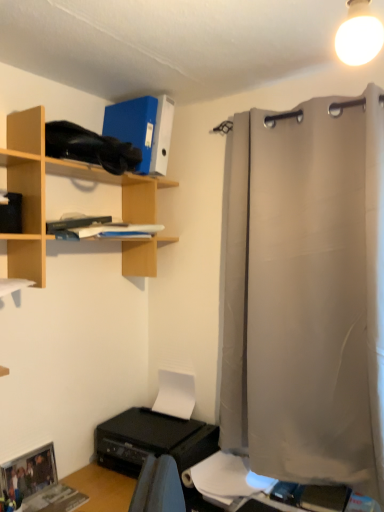
Question: Is point (374, 256) closer or farther from the camera than point (216, 470)?

Choices:
 (A) farther
 (B) closer

Answer: (B)

Question: Considering the positions of light gray fabric curtain at right and white paper at lower center in the image, is light gray fabric curtain at right bigger or smaller than white paper at lower center?

Choices:
 (A) big
 (B) small

Answer: (A)

Question: Estimate the real-world distances between objects in this image. Which object is closer to the wooden shelf at upper left?

Choices:
 (A) black plastic printer at lower left
 (B) white paper at lower center
 (C) light gray fabric curtain at right
 (D) white matte book at upper center
 (E) white matte paper at lower center

Answer: (D)

Question: Estimate the real-world distances between objects in this image. Which object is farther from the white matte book at upper center?

Choices:
 (A) white matte paper at lower center
 (B) black plastic printer at lower left
 (C) light gray fabric curtain at right
 (D) white paper at lower center
 (E) wooden shelf at upper left

Answer: (D)